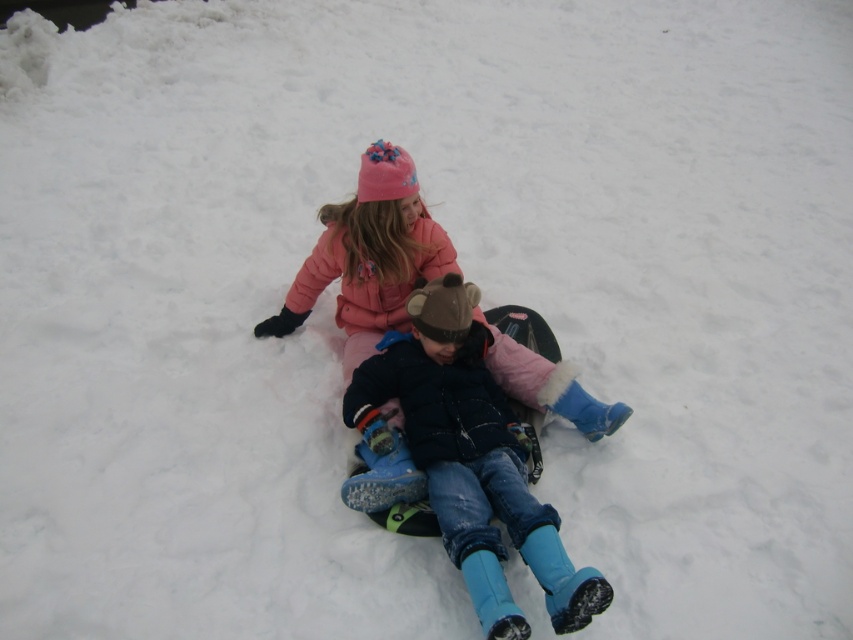
Is blue fuzzy boots at center thinner than matte pink coat at center?

Indeed, blue fuzzy boots at center has a lesser width compared to matte pink coat at center.

Is blue fuzzy boots at center taller than matte pink coat at center?

Yes.

Image resolution: width=853 pixels, height=640 pixels. What do you see at coordinates (469, 460) in the screenshot?
I see `blue fuzzy boots at center` at bounding box center [469, 460].

Find the location of a particular element. Image resolution: width=853 pixels, height=640 pixels. blue fuzzy boots at center is located at coordinates (469, 460).